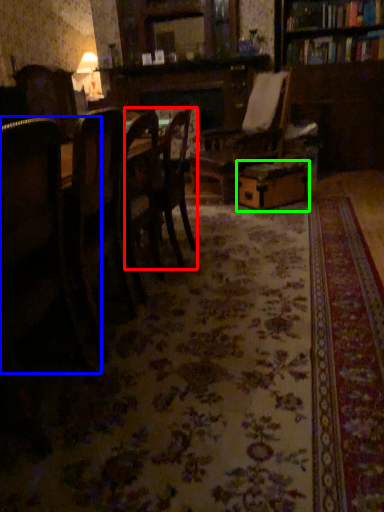
Question: Estimate the real-world distances between objects in this image. Which object is closer to chair (highlighted by a red box), chair (highlighted by a blue box) or cardboard box (highlighted by a green box)?

Choices:
 (A) chair
 (B) cardboard box

Answer: (A)